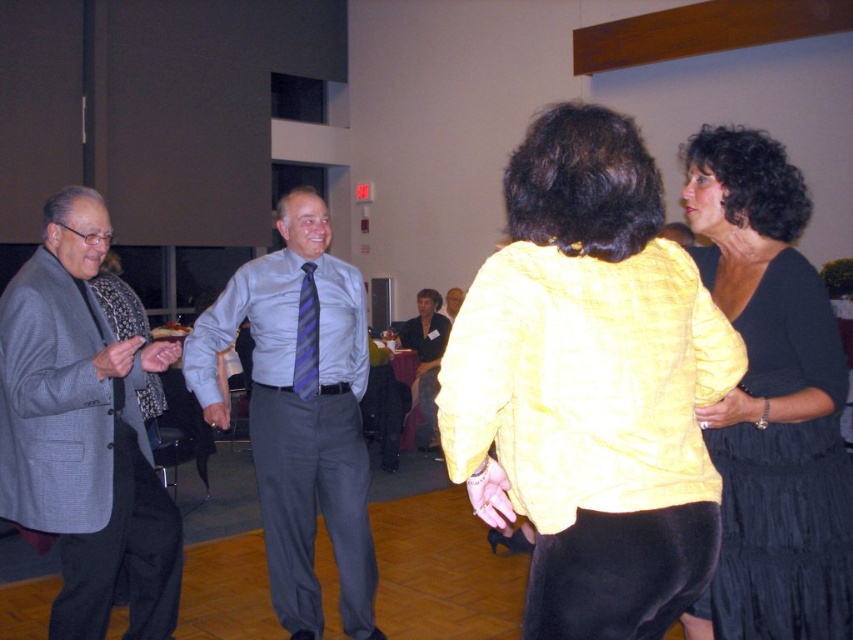
You are at a formal event and notice two items at the center of the image. The yellow fabric blouse at center and the purple striped tie at center. Which one is positioned lower?

The yellow fabric blouse at center is below the purple striped tie at center, so the yellow fabric blouse at center is positioned lower.

You are at a formal event and notice two items of clothing worn by attendees. The gray textured blazer at left and the light blue striped tie at center. Based on their positions, which clothing item is positioned more to the east in the image?

The gray textured blazer at left is positioned to the left of the light blue striped tie at center, so the gray textured blazer at left is more to the east since it is on the left side of the image.